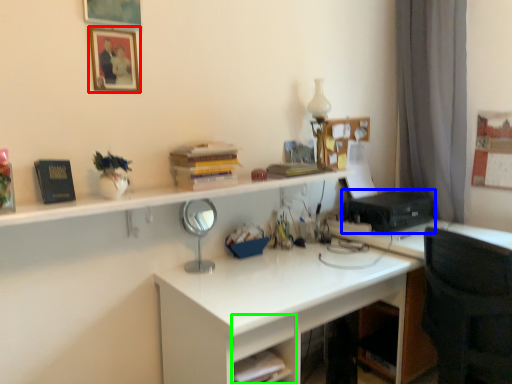
Question: Considering the real-world distances, which object is farthest from picture frame (highlighted by a red box)? printer (highlighted by a blue box) or drawer (highlighted by a green box)?

Choices:
 (A) printer
 (B) drawer

Answer: (A)